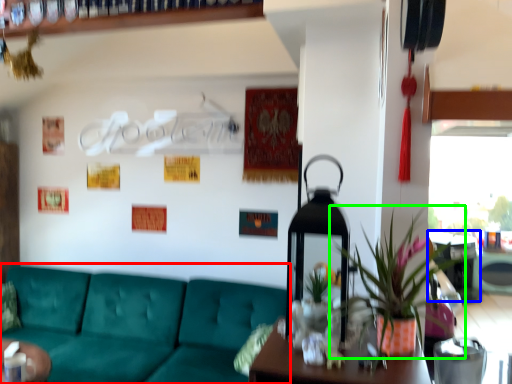
Question: Considering the real-world distances, which object is farthest from studio couch (highlighted by a red box)? table (highlighted by a blue box) or houseplant (highlighted by a green box)?

Choices:
 (A) table
 (B) houseplant

Answer: (A)